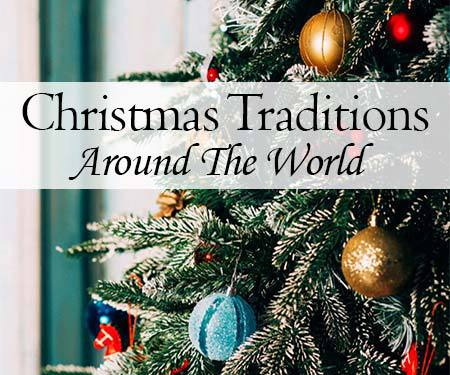
At what (x,y) coordinates should I click in order to perform the action: click on wall in background. Please return your answer as a coordinate pair (x, y). The width and height of the screenshot is (450, 375). Looking at the image, I should click on (152, 34).